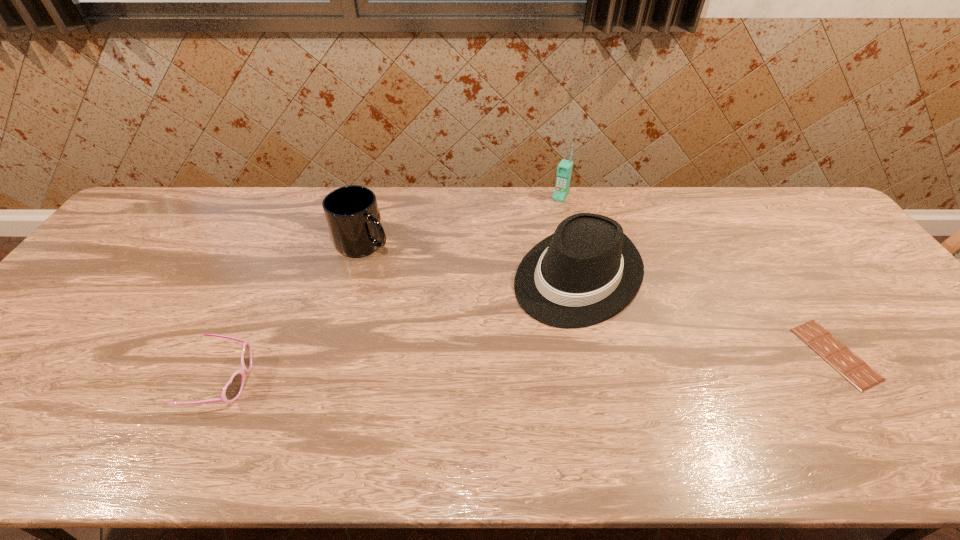
At what (x,y) coordinates should I click in order to perform the action: click on free space that satisfies the following two spatial constraints: 1. on the front side of the mug; 2. on the left side of the fedora. Please return your answer as a coordinate pair (x, y). The width and height of the screenshot is (960, 540). Looking at the image, I should click on (355, 275).